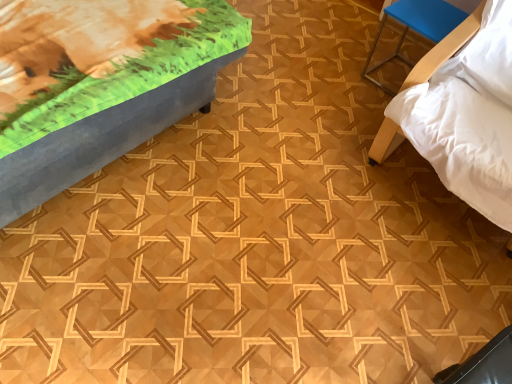
Image resolution: width=512 pixels, height=384 pixels. Identify the location of vacant region below blue plastic stool at upper right, marked as the second furniture in a left-to-right arrangement (from a real-world perspective). (393, 75).